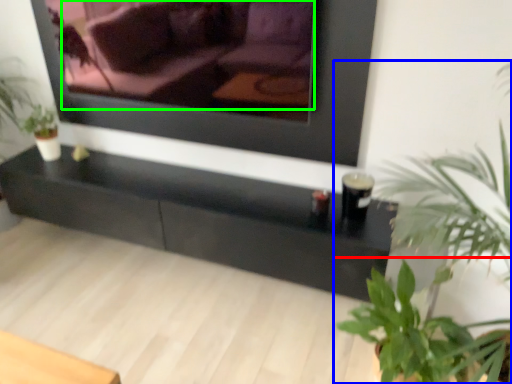
Question: Based on their relative distances, which object is nearer to houseplant (highlighted by a red box)? Choose from houseplant (highlighted by a blue box) and couch (highlighted by a green box).

Choices:
 (A) houseplant
 (B) couch

Answer: (A)